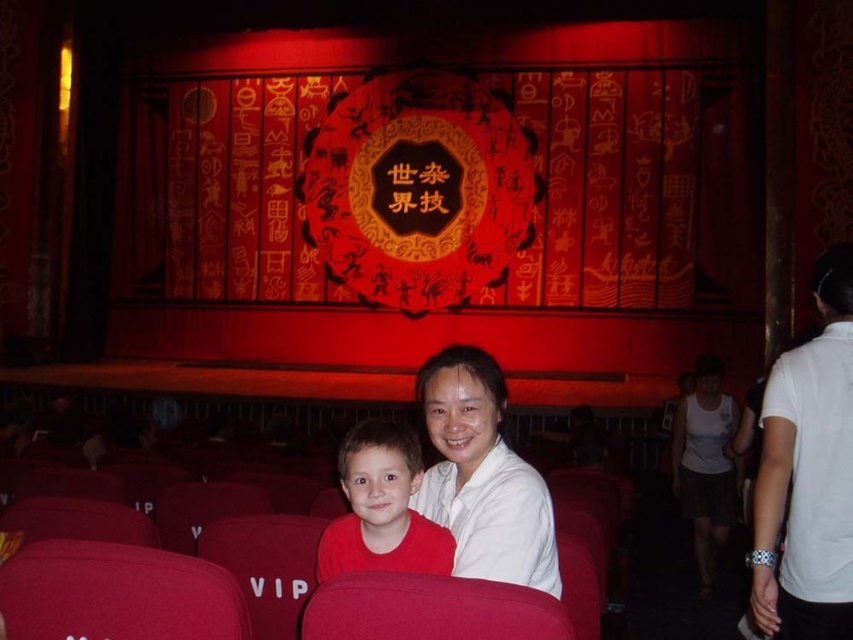
Question: Can you confirm if matte red shirt at center is bigger than vip fabric at center?

Choices:
 (A) no
 (B) yes

Answer: (B)

Question: Based on their relative distances, which object is farther from the white fabric skirt at lower right?

Choices:
 (A) matte red shirt at center
 (B) vip fabric at center
 (C) white matte shirt at center
 (D) velvet red seat at lower left

Answer: (D)

Question: Which object appears farthest from the camera in this image?

Choices:
 (A) white fabric skirt at lower right
 (B) white cotton shirt at right
 (C) white matte shirt at center

Answer: (A)

Question: Does velvet red seat at lower left appear on the right side of vip fabric at center?

Choices:
 (A) yes
 (B) no

Answer: (B)

Question: In this image, where is white matte shirt at center located relative to suede-like red seat at center?

Choices:
 (A) right
 (B) left

Answer: (A)

Question: Based on their relative distances, which object is farther from the white cotton shirt at right?

Choices:
 (A) matte red shirt at center
 (B) white matte shirt at center

Answer: (B)